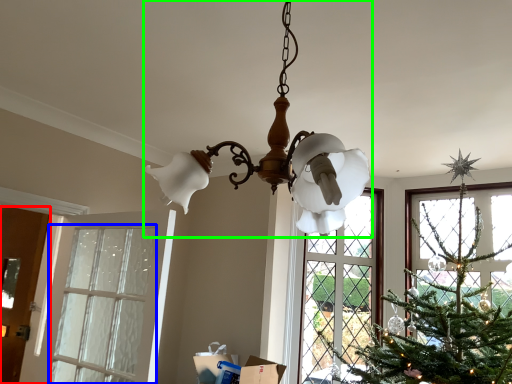
Question: Which is farther away from door (highlighted by a red box)? window (highlighted by a blue box) or lamp (highlighted by a green box)?

Choices:
 (A) window
 (B) lamp

Answer: (B)